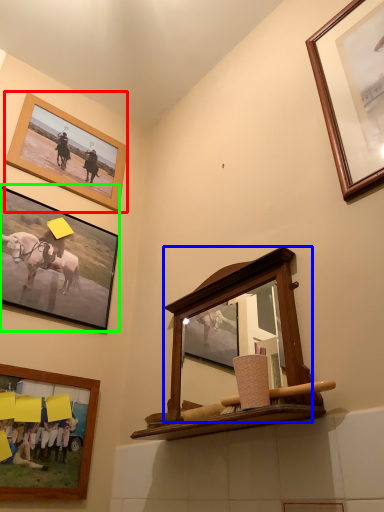
Question: Which object is the closest to the picture frame (highlighted by a red box)? Choose among these: mirror (highlighted by a blue box) or picture frame (highlighted by a green box).

Choices:
 (A) mirror
 (B) picture frame

Answer: (B)